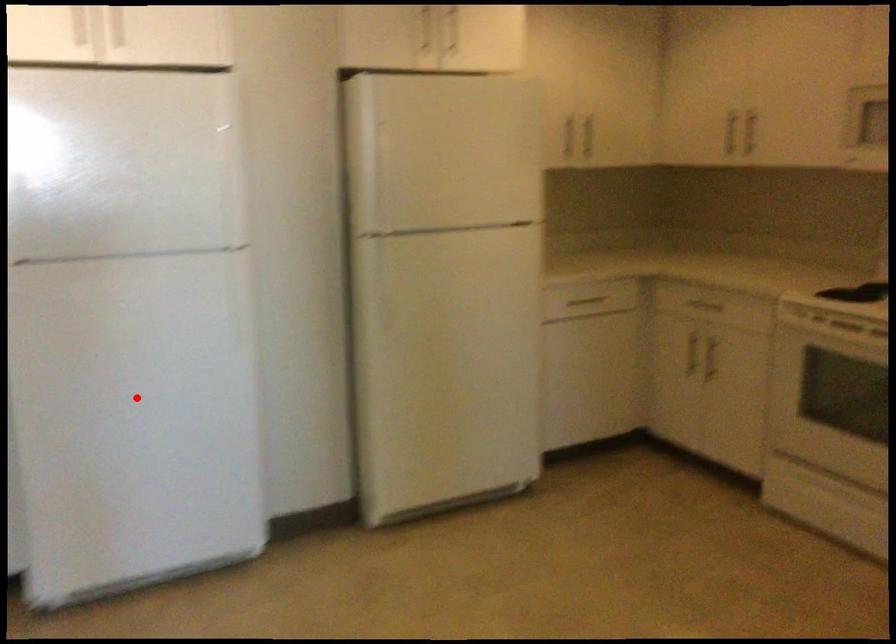
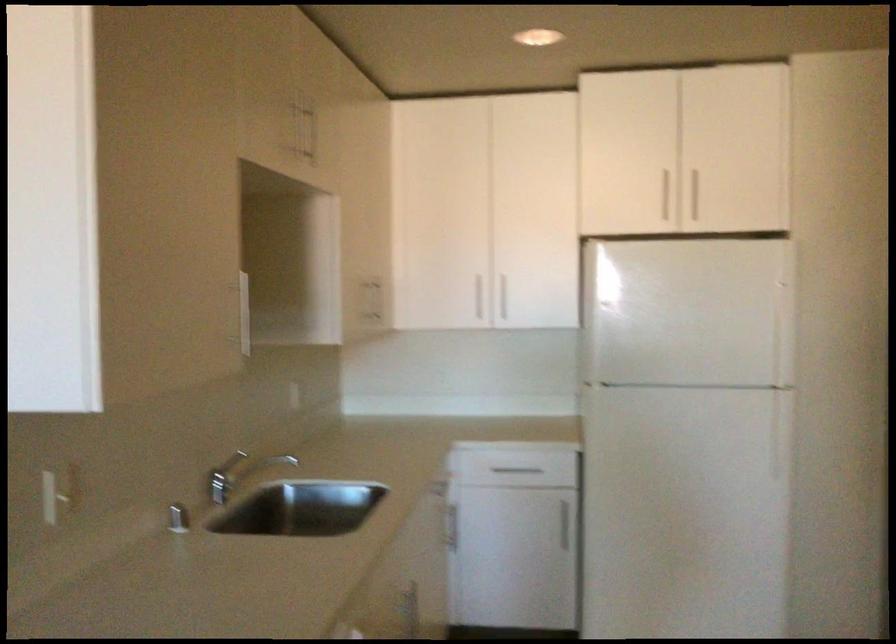
Question: I am providing you with two images of the same scene from different viewpoints. A red point is shown in image1. For the corresponding object point in image2, is it positioned nearer or farther from the camera?

Choices:
 (A) Nearer
 (B) Farther

Answer: (B)